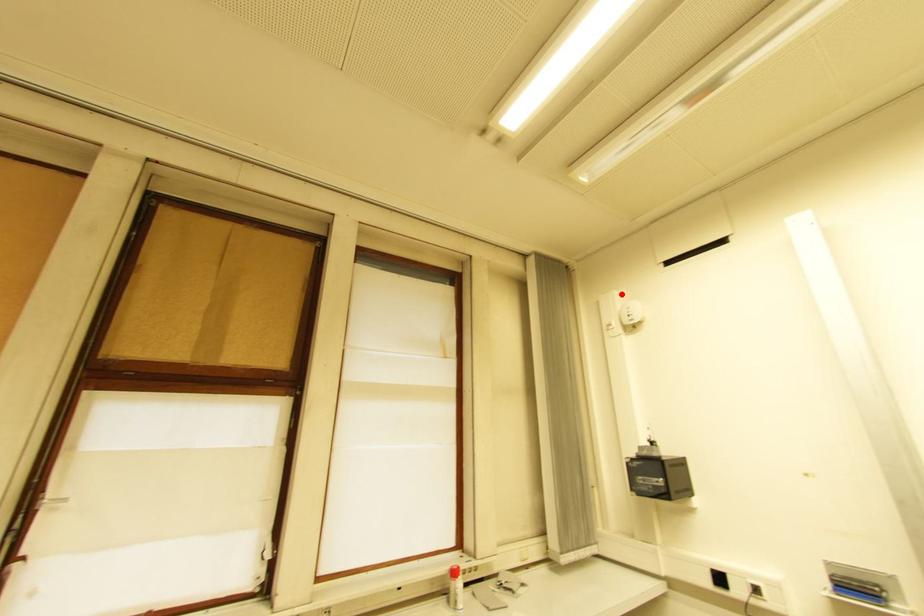
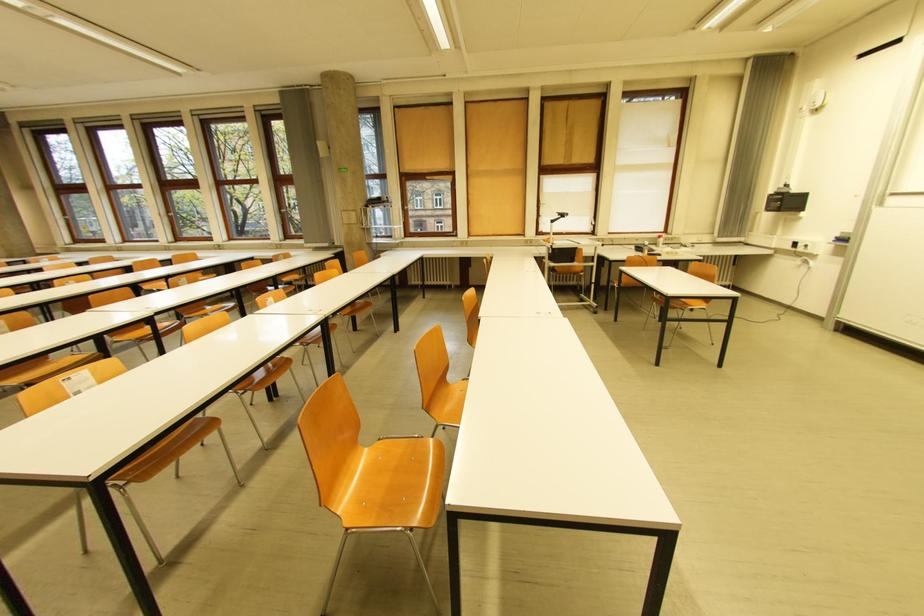
Question: I am providing you with two images of the same scene from different viewpoints. A red point is marked on the first image. Can you still see the location of the red point in image 2?

Choices:
 (A) Yes
 (B) No

Answer: (A)